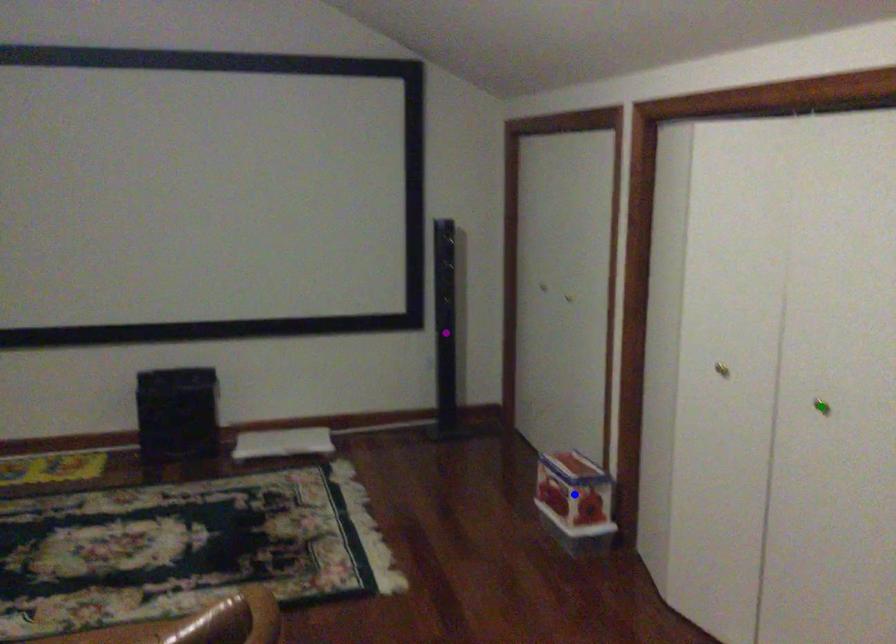
Order these from nearest to farthest:
- blue point
- green point
- purple point

green point < blue point < purple point